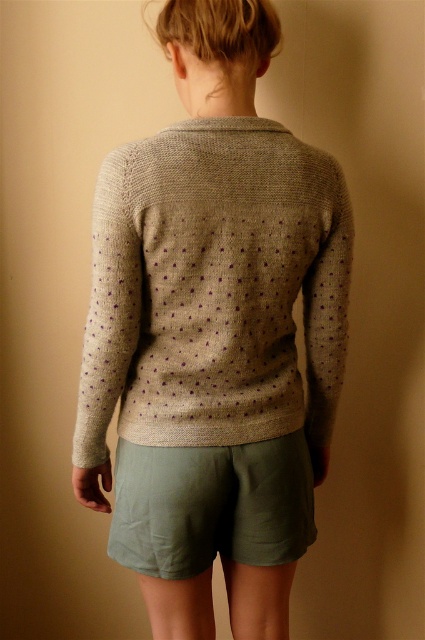
Between knitted beige cardigan at center and olive green cotton shorts at lower center, which one has more height?

With more height is knitted beige cardigan at center.

Locate an element on the screen. The width and height of the screenshot is (425, 640). knitted beige cardigan at center is located at coordinates (214, 289).

Where is `knitted beige cardigan at center`? This screenshot has height=640, width=425. knitted beige cardigan at center is located at coordinates (214, 289).